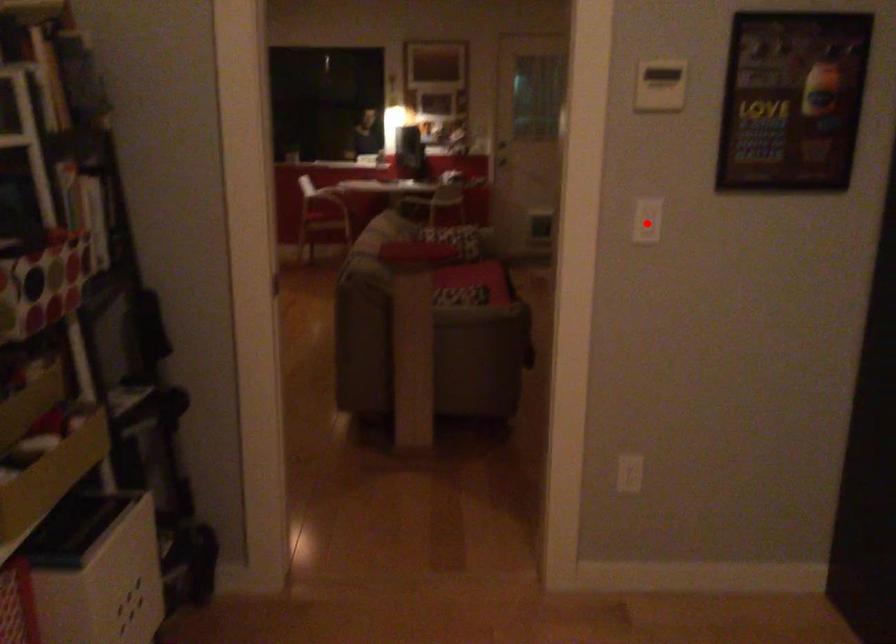
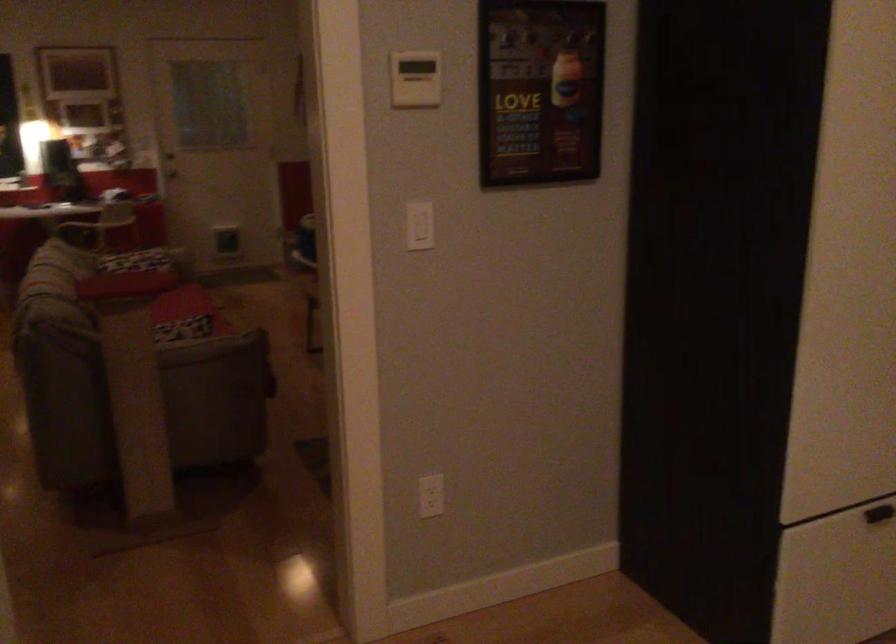
Where in the second image is the point corresponding to the highlighted location from the first image?

(419, 225)